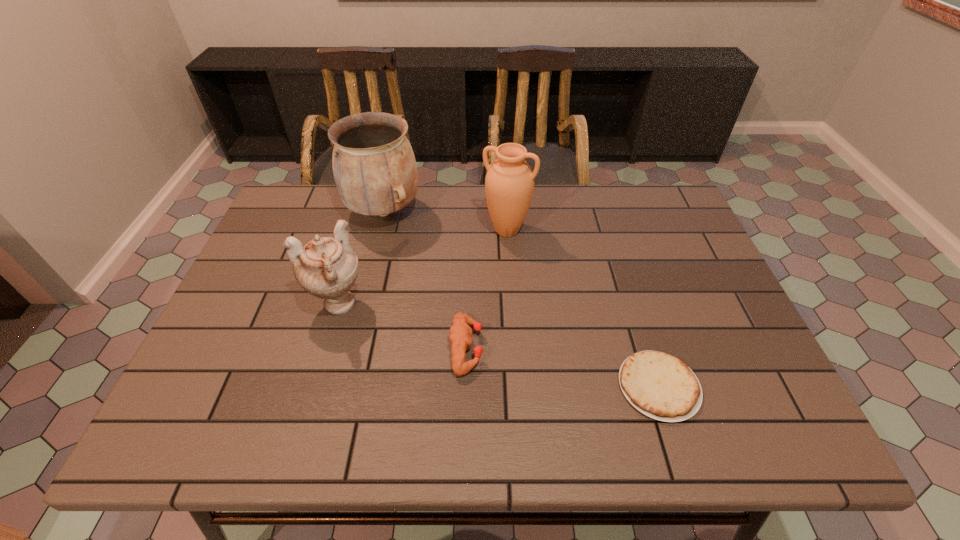
Where is `the fourth object from left to right`? The width and height of the screenshot is (960, 540). the fourth object from left to right is located at coordinates (509, 183).

This screenshot has height=540, width=960. What are the coordinates of `the nearest urn` in the screenshot? It's located at (326, 267).

The width and height of the screenshot is (960, 540). Find the location of `the shortest urn`. the shortest urn is located at coordinates (326, 267).

In order to click on the third object from left to right in this screenshot , I will do `click(460, 332)`.

The width and height of the screenshot is (960, 540). Find the location of `the fourth tallest object`. the fourth tallest object is located at coordinates (460, 332).

Where is `the shortest object`? The height and width of the screenshot is (540, 960). the shortest object is located at coordinates (661, 386).

This screenshot has width=960, height=540. Identify the location of tortilla. (661, 386).

You are a GUI agent. You are given a task and a screenshot of the screen. Output one action in this format:
    pyautogui.click(x=<x>, y=<y>)
    Task: Click on the vacant space located 0.090m on the back of the second object from right to left
    This screenshot has height=540, width=960.
    Given the screenshot: What is the action you would take?
    pyautogui.click(x=505, y=199)

Where is `free point located on the right of the nearest urn`? The width and height of the screenshot is (960, 540). free point located on the right of the nearest urn is located at coordinates [x=476, y=305].

The width and height of the screenshot is (960, 540). What are the coordinates of `vacant space located with the gloves of the fourth tallest object facing forward` in the screenshot? It's located at (591, 348).